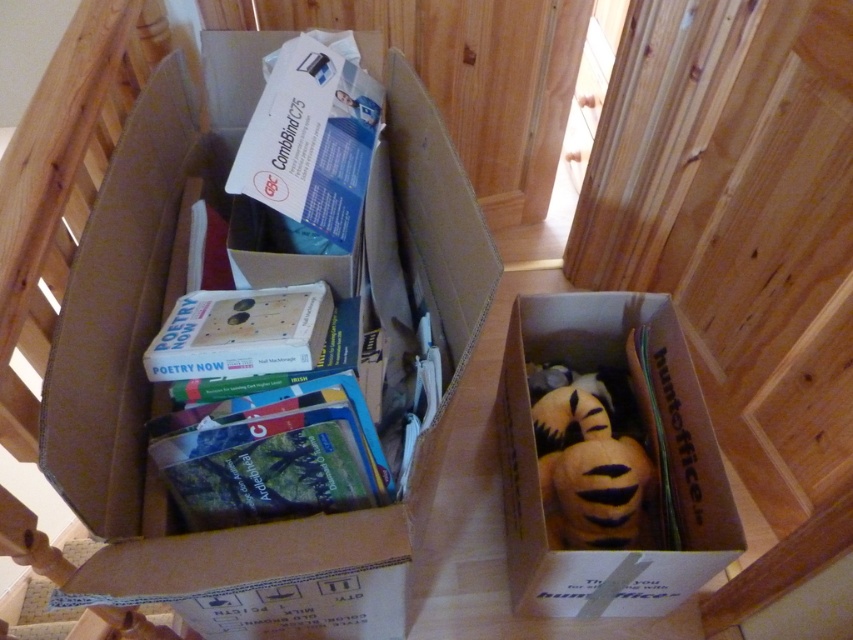
Who is shorter, hardcover book at center or velvet plush toy at lower right?

Standing shorter between the two is velvet plush toy at lower right.

Between hardcover book at center and velvet plush toy at lower right, which one has more height?

With more height is hardcover book at center.

Where is `hardcover book at center`? hardcover book at center is located at coordinates (271, 454).

Does matte cardboard book at center appear on the right side of velvet plush toy at lower right?

Incorrect, matte cardboard book at center is not on the right side of velvet plush toy at lower right.

Who is lower down, matte cardboard book at center or velvet plush toy at lower right?

velvet plush toy at lower right is lower down.

Where is `matte cardboard book at center`? matte cardboard book at center is located at coordinates (241, 333).

Which of these two, brown cardboard at upper left or velvet plush toy at lower right, stands taller?

brown cardboard at upper left

Is brown cardboard at upper left wider than velvet plush toy at lower right?

In fact, brown cardboard at upper left might be narrower than velvet plush toy at lower right.

Is point (112, 113) more distant than point (585, 476)?

No, it is in front of (585, 476).

You are a GUI agent. You are given a task and a screenshot of the screen. Output one action in this format:
    pyautogui.click(x=<x>, y=<y>)
    Task: Click on the brown cardboard at upper left
    The height and width of the screenshot is (640, 853).
    Given the screenshot: What is the action you would take?
    pyautogui.click(x=62, y=180)